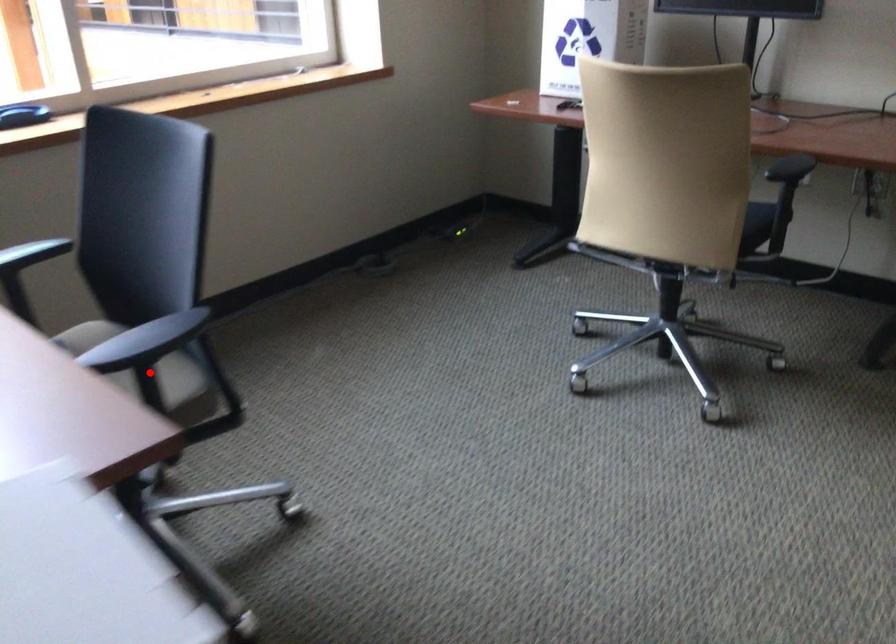
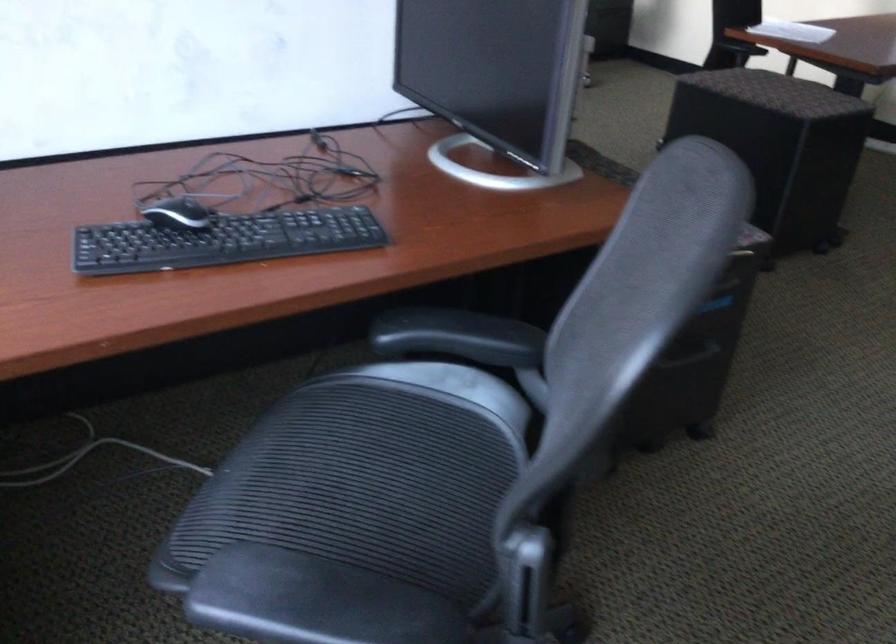
Question: I am providing you with two images of the same scene from different viewpoints. A red point is marked on the first image. Is the red point's position out of view in image 2?

Choices:
 (A) Yes
 (B) No

Answer: (A)